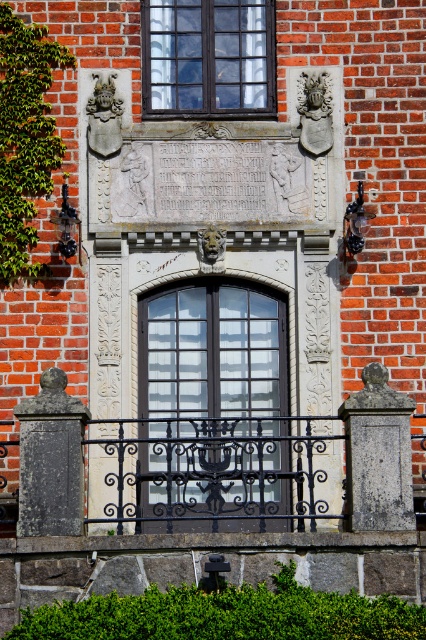
From the picture: You are a painter who needs to decide whether to place a ladder against the black wrought iron railing at center or the sandy stone lion at center. Which object is taller and thus requires a taller ladder?

The black wrought iron railing at center is much taller than the sandy stone lion at center, so you should use a taller ladder for the black wrought iron railing at center.